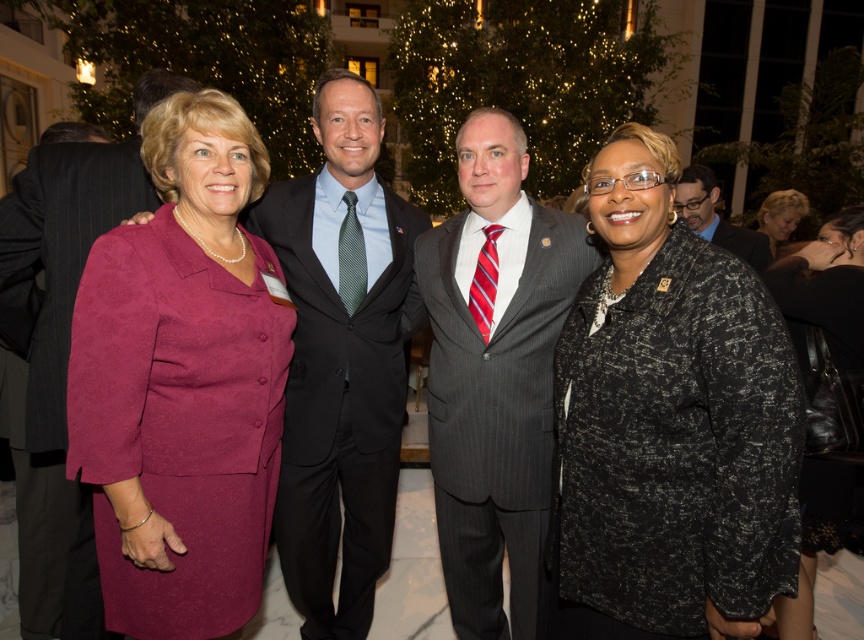
Which is behind, point (183, 472) or point (776, 216)?

Positioned behind is point (776, 216).

Can you confirm if matte pink suit at left is positioned to the right of blonde hair at upper right?

Incorrect, matte pink suit at left is not on the right side of blonde hair at upper right.

Image resolution: width=864 pixels, height=640 pixels. Find the location of `matte pink suit at left`. matte pink suit at left is located at coordinates (182, 381).

Does black textured blazer at right appear over dark gray pinstripe suit at center?

Yes.

Is black textured blazer at right thinner than dark gray pinstripe suit at center?

Correct, black textured blazer at right's width is less than dark gray pinstripe suit at center's.

Where is `black textured blazer at right`? black textured blazer at right is located at coordinates (669, 422).

Where is `black textured blazer at right`? This screenshot has height=640, width=864. black textured blazer at right is located at coordinates (669, 422).

Between point (740, 424) and point (726, 248), which one is positioned in front?

Point (740, 424) is in front.

The width and height of the screenshot is (864, 640). What do you see at coordinates (669, 422) in the screenshot? I see `black textured blazer at right` at bounding box center [669, 422].

Identify the location of black textured blazer at right. This screenshot has height=640, width=864. (669, 422).

This screenshot has height=640, width=864. Identify the location of black textured blazer at right. (669, 422).